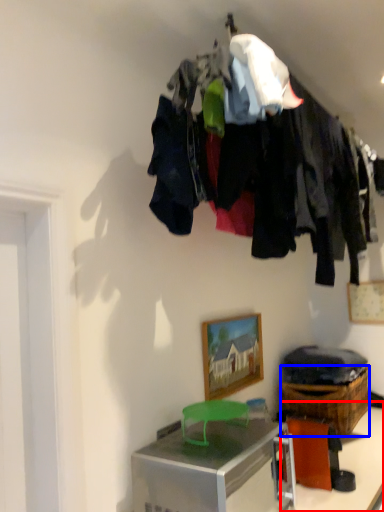
Question: Which object appears farthest to the camera in this image, table (highlighted by a red box) or crate (highlighted by a blue box)?

Choices:
 (A) table
 (B) crate

Answer: (B)